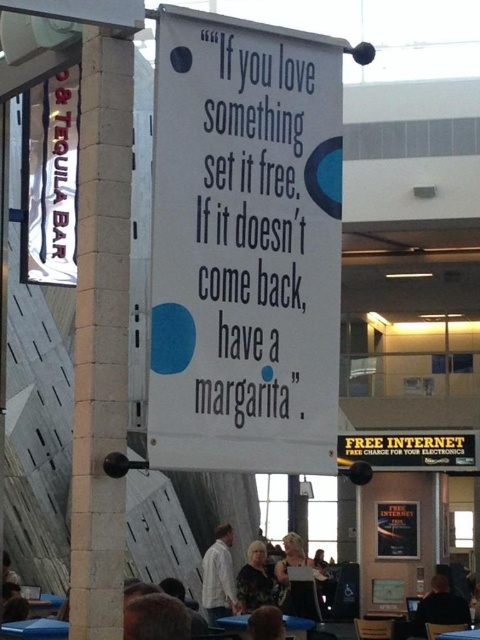
How distant is white brick pillar at left from white shirt at center?

white brick pillar at left is 21.77 meters away from white shirt at center.

Between white brick pillar at left and white shirt at center, which one appears on the left side from the viewer's perspective?

Positioned to the left is white brick pillar at left.

The width and height of the screenshot is (480, 640). What are the coordinates of `white brick pillar at left` in the screenshot? It's located at (100, 330).

The height and width of the screenshot is (640, 480). I want to click on white brick pillar at left, so coord(100,330).

Which of these two, white brick pillar at left or floral-patterned blouse at center, stands shorter?

floral-patterned blouse at center

Between point (76, 374) and point (252, 541), which one is positioned behind?

The point (252, 541) is behind.

Locate an element on the screen. This screenshot has height=640, width=480. white brick pillar at left is located at coordinates (100, 330).

Based on the photo, who is positioned more to the right, white brick pillar at left or yellow paper sign at center?

yellow paper sign at center

Can you confirm if white brick pillar at left is bigger than yellow paper sign at center?

Indeed, white brick pillar at left has a larger size compared to yellow paper sign at center.

What do you see at coordinates (100, 330) in the screenshot? Image resolution: width=480 pixels, height=640 pixels. I see `white brick pillar at left` at bounding box center [100, 330].

Locate an element on the screen. The width and height of the screenshot is (480, 640). white brick pillar at left is located at coordinates (100, 330).